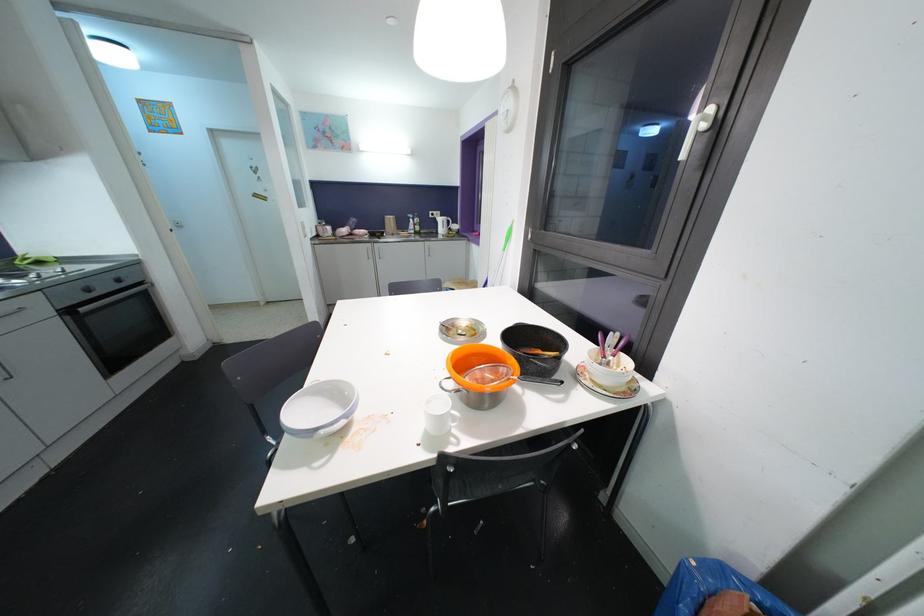
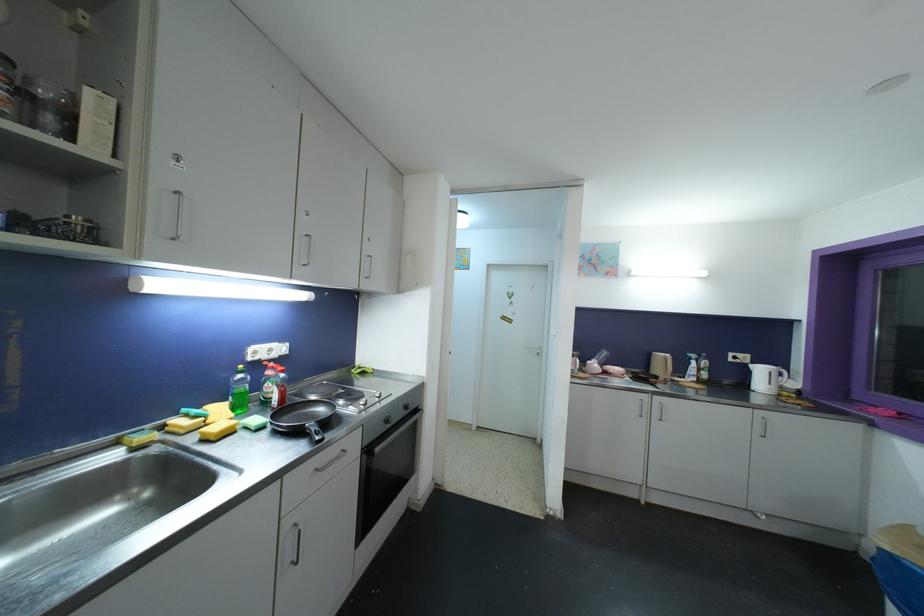
Find the pixel in the second image that matches (x=433, y=215) in the first image.

(734, 357)